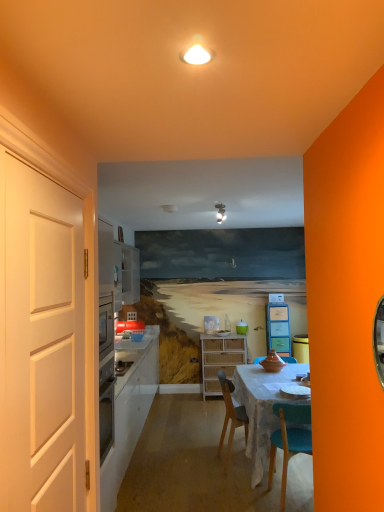
Where is `free space above white matte door at left (from a real-world perspective)`? Image resolution: width=384 pixels, height=512 pixels. free space above white matte door at left (from a real-world perspective) is located at coordinates (55, 178).